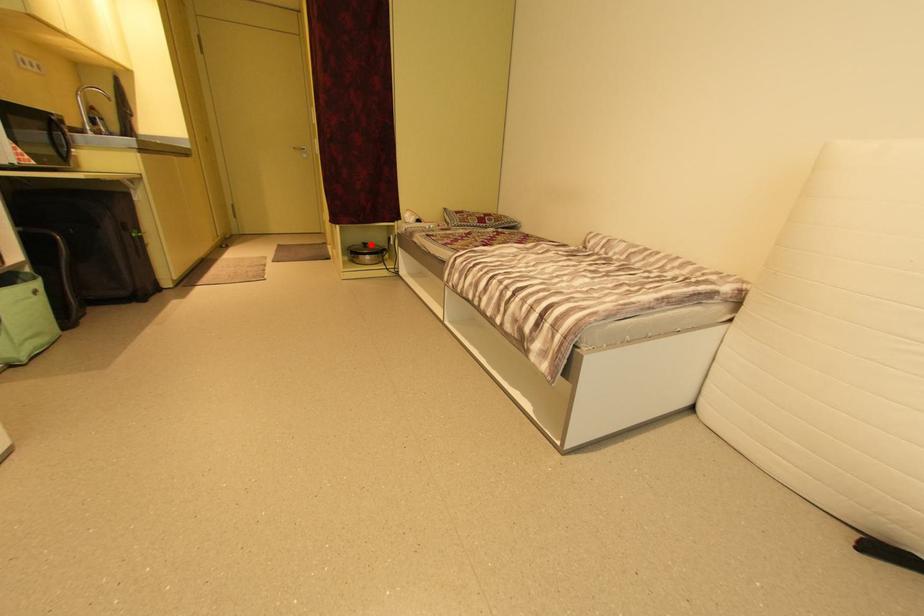
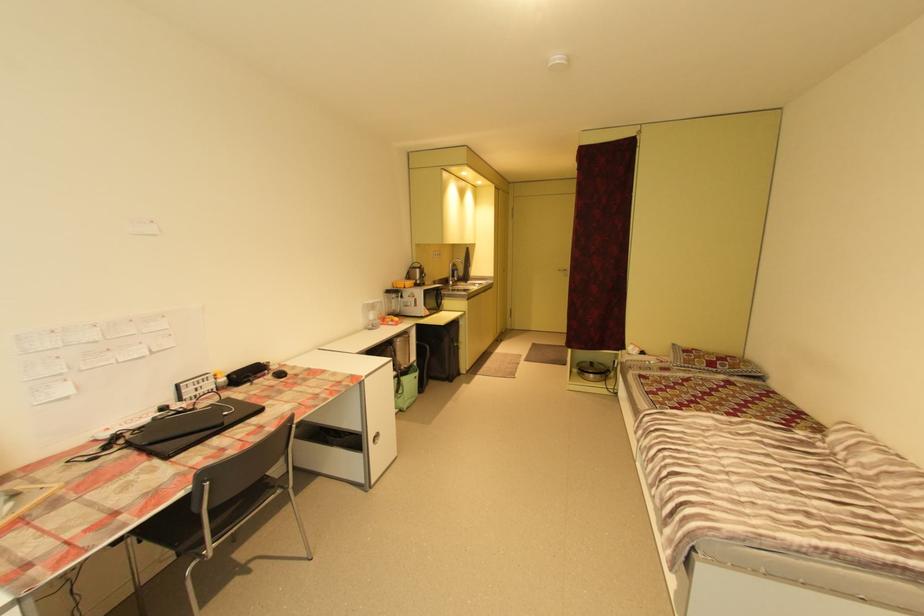
Question: A red point is marked in image1. In image2, is the corresponding 3D point closer to the camera or farther? Reply with the corresponding letter.

Choices:
 (A) The corresponding 3D point is closer.
 (B) The corresponding 3D point is farther.

Answer: (B)